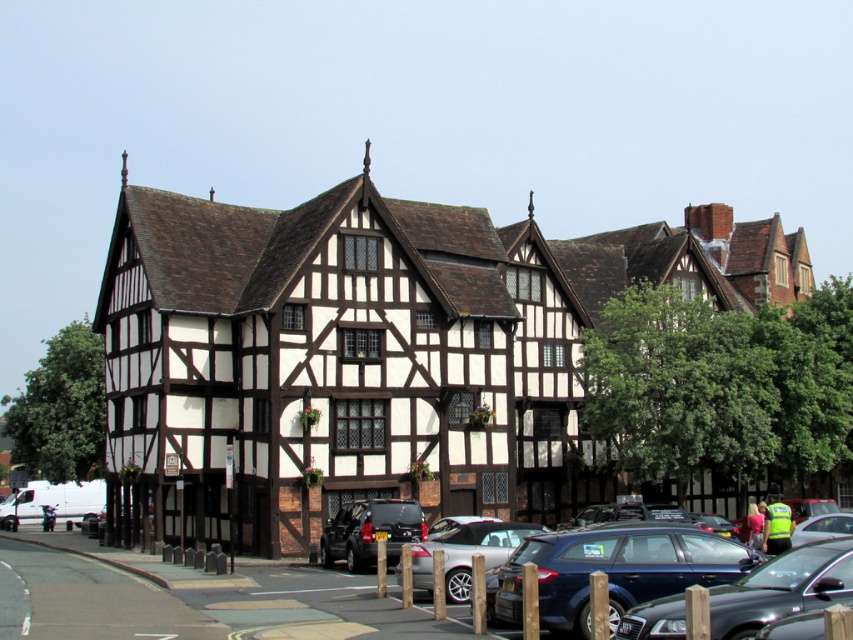
You are a delivery person who needs to park your truck next to the metallic blue hatchback at center and the silver metallic car at lower center. Which vehicle should you park closer to if your truck is 6 meters long and the space between them is only 5 meters?

The metallic blue hatchback at center is smaller than the silver metallic car at lower center, so you should park closer to the metallic blue hatchback at center to save space.

You are standing in the parking area and want to walk towards the Tudor buildings. Which point, point (592, 529) or point (413, 556), is closer to you as you face the buildings?

Point (592, 529) is closer to the viewer than point (413, 556), so it is closer to you as you face the Tudor buildings.

You are a delivery driver trying to park your truck, which is 2.5 meters wide, in the parking area near the Tudor buildings. You notice the metallic blue sedan at center and the silver metallic car at lower center parked there. Can your truck fit between these two cars if the space between them is exactly the width of the wider of the two cars?

The metallic blue sedan at center might be wider than silver metallic car at lower center. Since the space between them is exactly the width of the wider car, and the truck is 2.5 meters wide, we need to know the exact width of the wider car. However, the description only states that the metallic blue sedan at center might be wider. Without specific measurements, it is uncertain if the truck can fit. Please verify the actual widths of the cars before attempting to park.